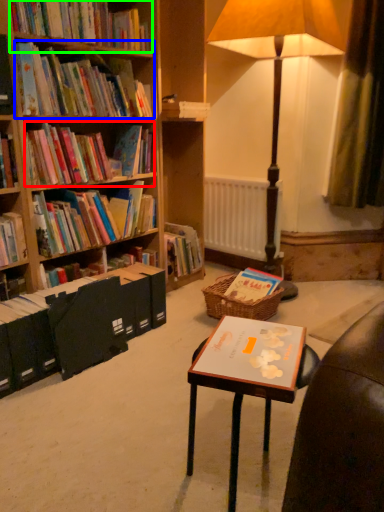
Question: Which object is the farthest from book (highlighted by a red box)? Choose among these: book (highlighted by a blue box) or book (highlighted by a green box).

Choices:
 (A) book
 (B) book

Answer: (B)